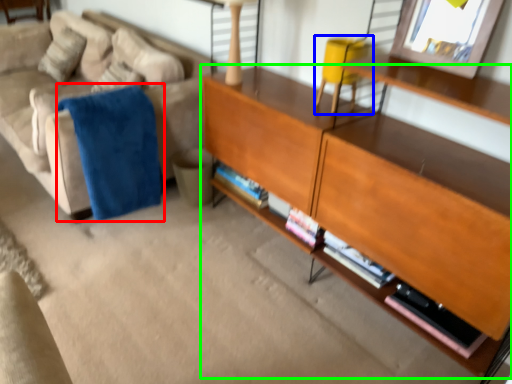
Question: Which object is the closest to the blanket (highlighted by a red box)? Choose among these: swivel chair (highlighted by a blue box) or shelf (highlighted by a green box).

Choices:
 (A) swivel chair
 (B) shelf

Answer: (B)